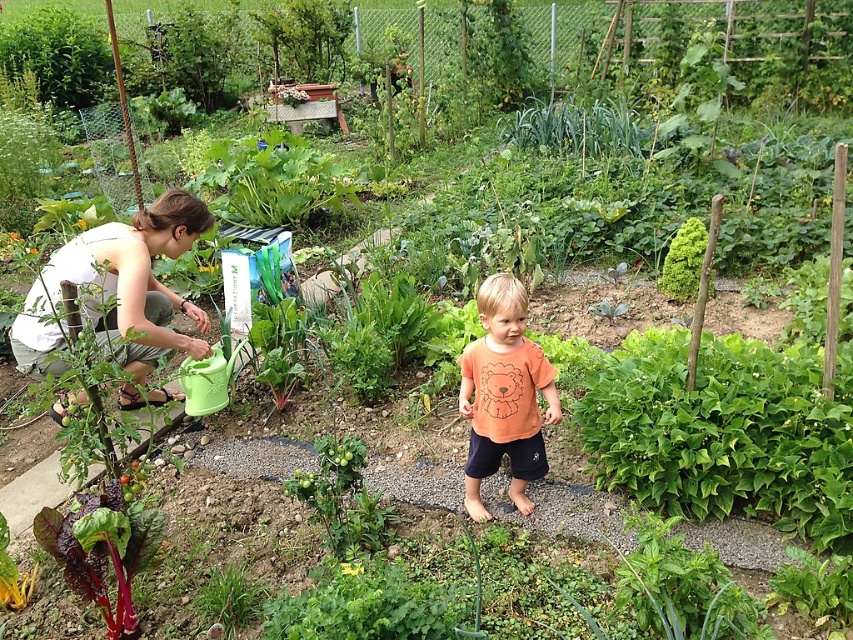
Which is behind, point (48, 364) or point (503, 307)?

The point (48, 364) is behind.

Between white cotton shirt at left and orange cotton shirt at center, which one has less height?

A: Standing shorter between the two is orange cotton shirt at center.

You are a GUI agent. You are given a task and a screenshot of the screen. Output one action in this format:
    pyautogui.click(x=<x>, y=<y>)
    Task: Click on the white cotton shirt at left
    The height and width of the screenshot is (640, 853).
    Given the screenshot: What is the action you would take?
    pyautogui.click(x=119, y=291)

Is point (483, 378) positioned behind point (97, 552)?

Yes.

Does orange cotton shirt at center appear on the right side of deep red leafy vegetable at lower left?

Indeed, orange cotton shirt at center is positioned on the right side of deep red leafy vegetable at lower left.

Is point (486, 420) closer to viewer compared to point (97, 602)?

That is False.

The height and width of the screenshot is (640, 853). In order to click on orange cotton shirt at center in this screenshot , I will do `click(503, 396)`.

Which is more to the left, white cotton shirt at left or deep red leafy vegetable at lower left?

white cotton shirt at left is more to the left.

Who is positioned more to the right, white cotton shirt at left or deep red leafy vegetable at lower left?

From the viewer's perspective, deep red leafy vegetable at lower left appears more on the right side.

Is point (105, 228) farther from viewer compared to point (122, 563)?

Yes.

Locate an element on the screen. This screenshot has height=640, width=853. white cotton shirt at left is located at coordinates (119, 291).